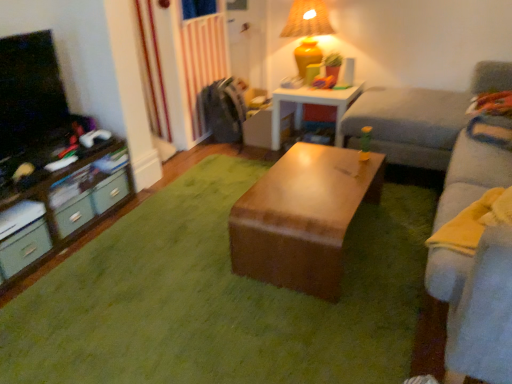
Where is `free location to the right of green matte drawer at left, which is the 2th drawer from front to back`? The image size is (512, 384). free location to the right of green matte drawer at left, which is the 2th drawer from front to back is located at coordinates (114, 230).